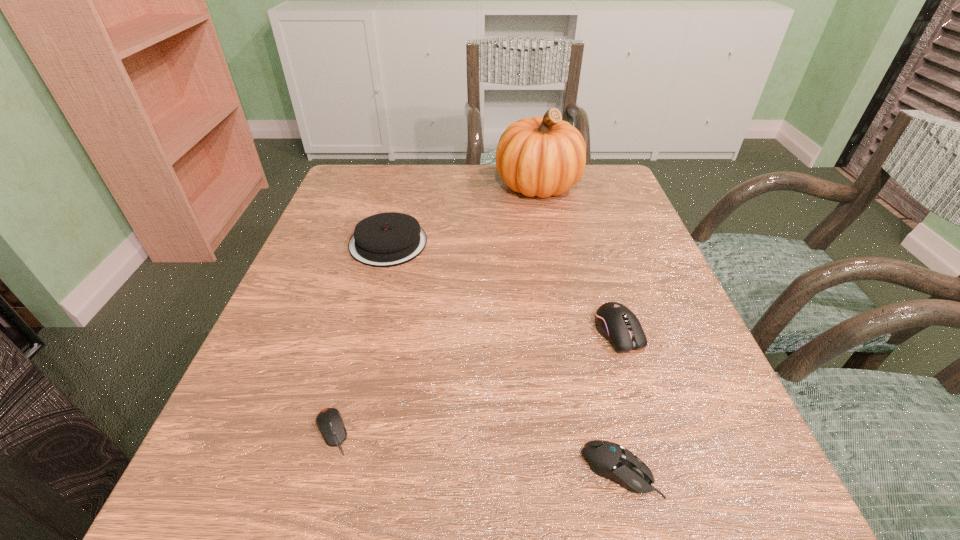
The height and width of the screenshot is (540, 960). Identify the location of the tallest object. (540, 156).

Locate an element on the screen. the farthest object is located at coordinates (540, 156).

Where is `the second farthest object`? The width and height of the screenshot is (960, 540). the second farthest object is located at coordinates (390, 239).

This screenshot has height=540, width=960. Identify the location of the third farthest object. (617, 323).

Where is `the tallest computer mouse`? The image size is (960, 540). the tallest computer mouse is located at coordinates (617, 323).

I want to click on the second shortest object, so click(609, 460).

Locate an element on the screen. The width and height of the screenshot is (960, 540). the shortest computer mouse is located at coordinates (329, 421).

Image resolution: width=960 pixels, height=540 pixels. What are the coordinates of `the leftmost computer mouse` in the screenshot? It's located at (329, 421).

Where is `vacant area located 0.080m on the right of the pumpkin`? vacant area located 0.080m on the right of the pumpkin is located at coordinates (612, 185).

Locate an element on the screen. The image size is (960, 540). vacant area situated 0.400m on the front of the pancake is located at coordinates (334, 453).